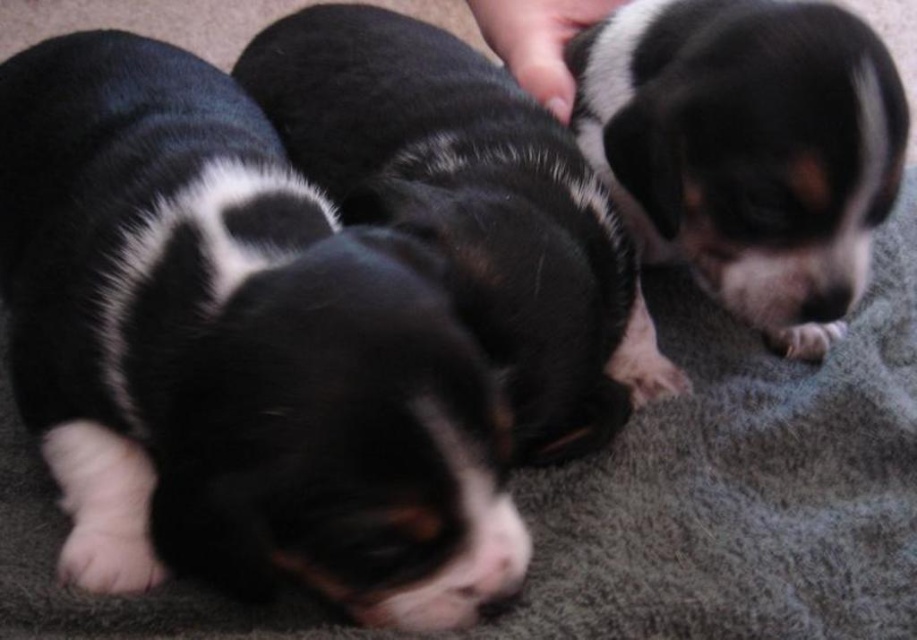
Which is below, black fur puppy at center or soft gray carpet at center?

soft gray carpet at center is lower down.

Is point (177, 486) more distant than point (638, 518)?

No, it is in front of (638, 518).

Which is in front, point (514, 577) or point (660, 428)?

Point (514, 577) is in front.

Image resolution: width=917 pixels, height=640 pixels. In order to click on black fur puppy at center in this screenshot , I will do `click(235, 353)`.

Is black fur puppy at center taller than black soft fur puppies at center?

Incorrect, black fur puppy at center's height is not larger of black soft fur puppies at center's.

Measure the distance between black fur puppy at center and camera.

black fur puppy at center is 41.72 centimeters from camera.

Find the location of a particular element. The image size is (917, 640). black fur puppy at center is located at coordinates (235, 353).

Who is more forward, (17, 538) or (610, 436)?

Positioned in front is point (17, 538).

Is soft gray carpet at center bigger than black soft fur puppies at center?

Yes.

Between point (604, 484) and point (490, 282), which one is positioned behind?

Point (604, 484)

This screenshot has width=917, height=640. What are the coordinates of `soft gray carpet at center` in the screenshot? It's located at (744, 484).